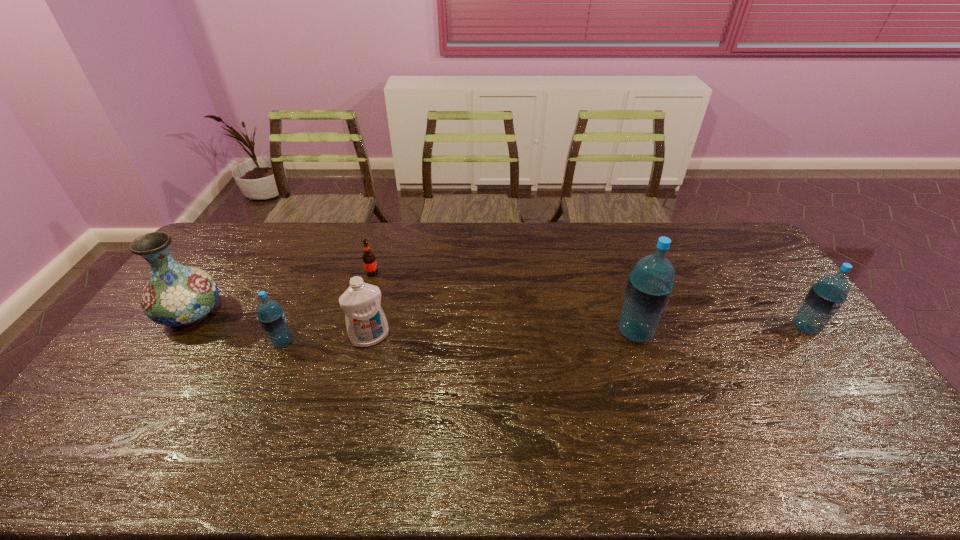
The height and width of the screenshot is (540, 960). Find the location of `vacant space located 0.210m on the back of the fifth object from right to left`. vacant space located 0.210m on the back of the fifth object from right to left is located at coordinates (306, 287).

Identify the location of vacant space located on the back of the tallest object. (621, 294).

The height and width of the screenshot is (540, 960). Find the location of `blank space located 0.310m on the left of the second shortest water bottle`. blank space located 0.310m on the left of the second shortest water bottle is located at coordinates (691, 328).

Locate an element on the screen. vacant space positioned 0.270m on the right of the shortest object is located at coordinates (454, 273).

Find the location of `vacant space located 0.170m on the front of the leftmost object`. vacant space located 0.170m on the front of the leftmost object is located at coordinates (142, 385).

The height and width of the screenshot is (540, 960). I want to click on free location located 0.100m on the front of the detergent, so click(x=360, y=377).

The image size is (960, 540). Identify the location of object that is at the left edge. (179, 296).

Where is `object present at the right edge`? object present at the right edge is located at coordinates (825, 298).

In the image, there is a desktop. Where is `vacant space at the far edge`? The width and height of the screenshot is (960, 540). vacant space at the far edge is located at coordinates (497, 236).

Locate an element on the screen. This screenshot has width=960, height=540. free space at the near edge of the desktop is located at coordinates (780, 423).